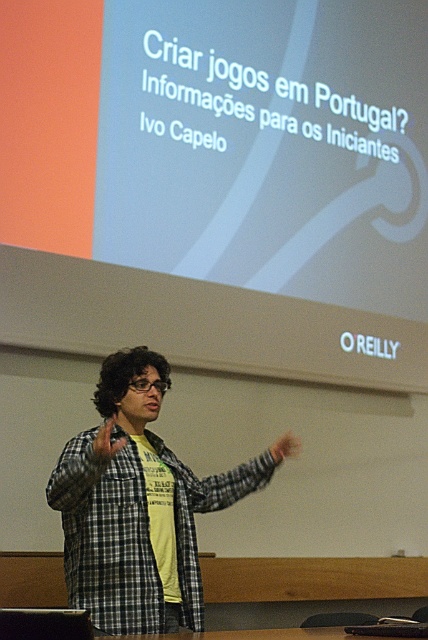
In the scene shown: Is checkered fabric shirt at center wider than brown leather hand at center?

Yes, checkered fabric shirt at center is wider than brown leather hand at center.

This screenshot has width=428, height=640. Describe the element at coordinates (136, 506) in the screenshot. I see `checkered fabric shirt at center` at that location.

The width and height of the screenshot is (428, 640). Find the location of `checkered fabric shirt at center`. checkered fabric shirt at center is located at coordinates (136, 506).